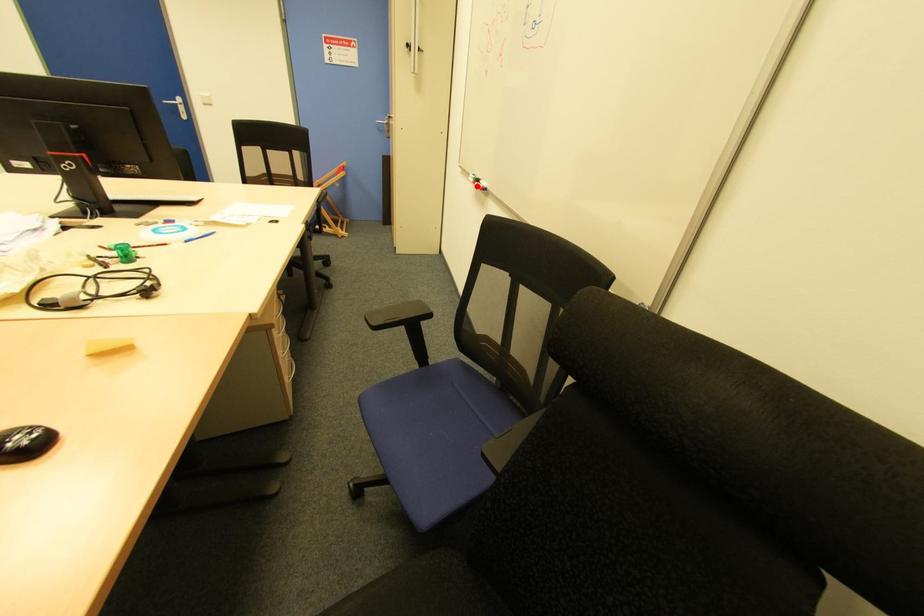
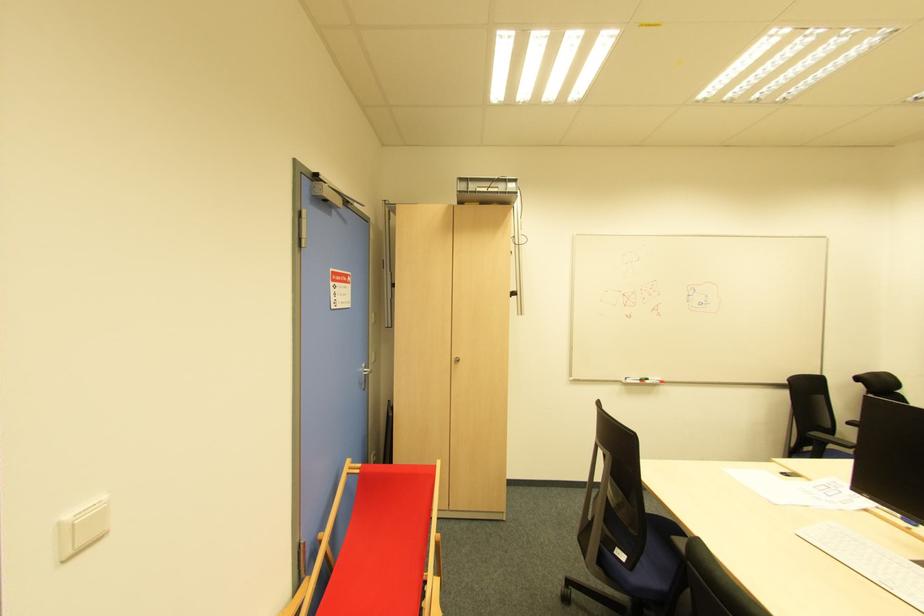
In the second image, find the point that corresponds to the highlighted location in the first image.

(647, 383)